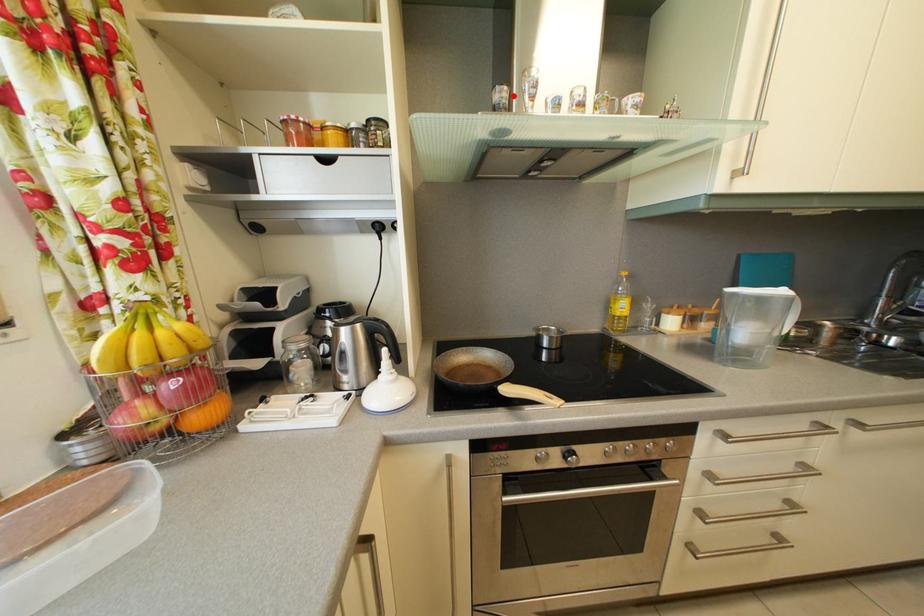
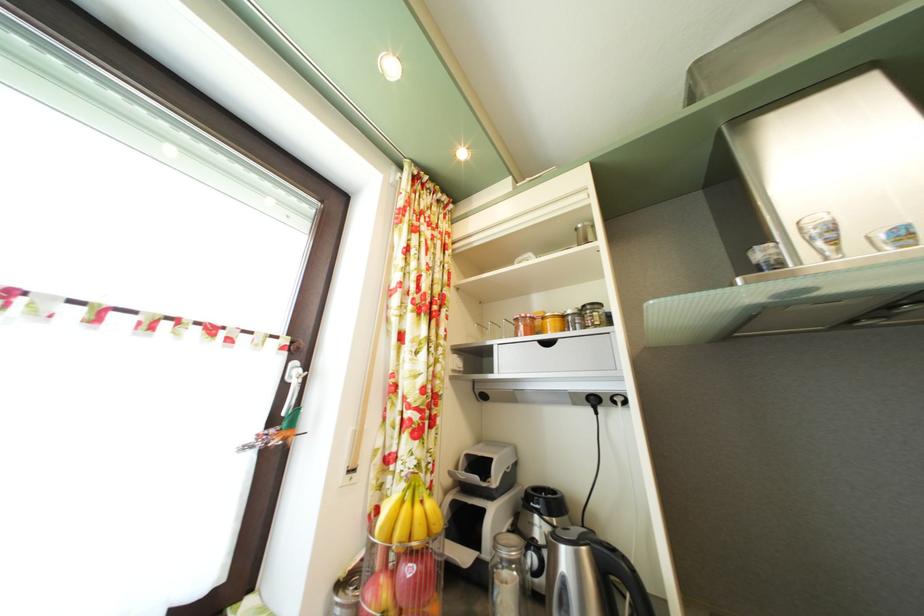
The point at the highlighted location is marked in the first image. Where is the corresponding point in the second image?

(781, 252)